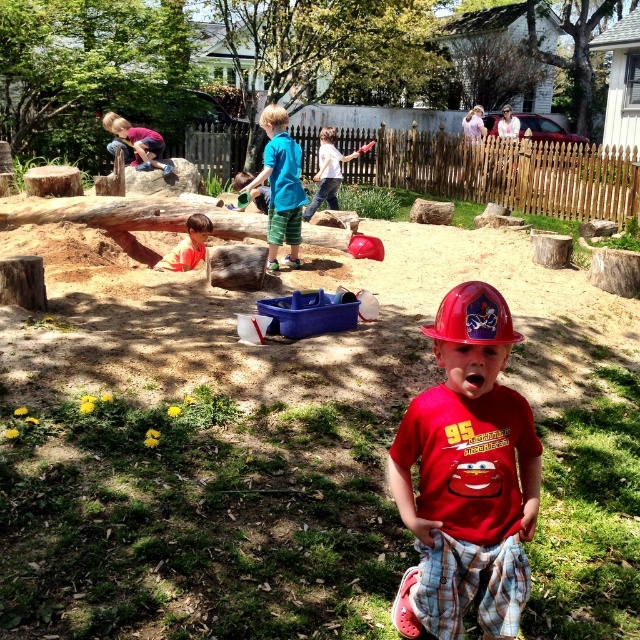
You are a construction worker who needs to choose between the red hard hat at center and the white cotton shirt at center for a safety helmet. Which item is narrower and thus more suitable for your head?

The red hard hat at center is narrower than the white cotton shirt at center, so it is more suitable for a safety helmet.

You are a photographer standing in the playground and want to take a photo that includes both the matte purple shirt at upper left and the orange shirt at center. Which shirt should you adjust your camera focus to first to ensure both are in the frame?

The matte purple shirt at upper left is closer to you than the orange shirt at center, so focus on the matte purple shirt at upper left first to ensure both are in the frame.

You are a parent at the playground and see your child wearing a matte purple shirt at upper left and another child wearing an orange shirt at center. You want to call your child to come to you, who is closer to you?

The matte purple shirt at upper left is 11.50 feet away from the orange shirt at center. Since the parent is at the playground, likely positioned near the center where the orange shirt is, the child in the orange shirt at center is closer to you.